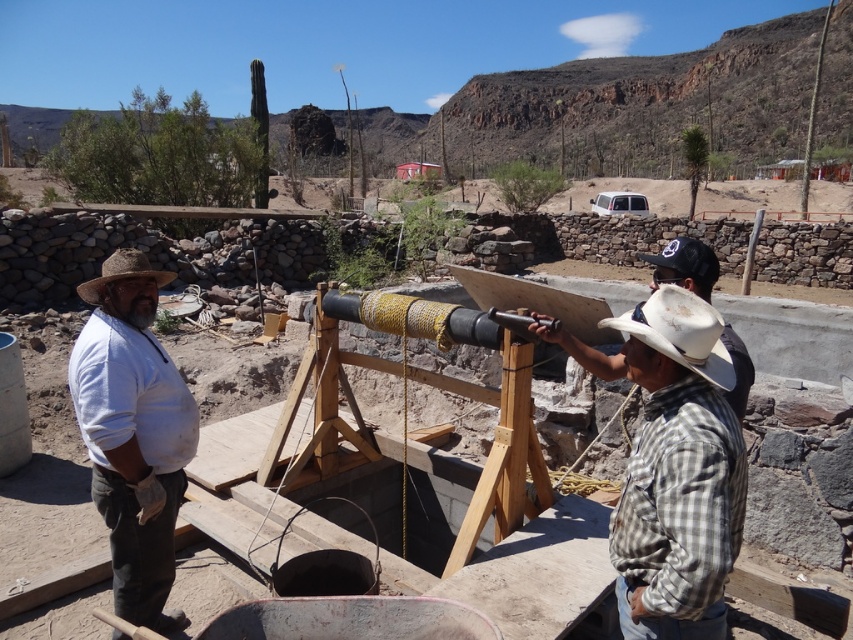
Is white checkered shirt at center above wooden telescope at center?

No.

Is white checkered shirt at center positioned behind wooden telescope at center?

That is False.

At what (x,y) coordinates should I click in order to perform the action: click on white checkered shirt at center. Please return your answer as a coordinate pair (x, y). Image resolution: width=853 pixels, height=640 pixels. Looking at the image, I should click on (677, 474).

Is white cotton shirt at left to the right of brown straw cowboy hat at left from the viewer's perspective?

Yes, white cotton shirt at left is to the right of brown straw cowboy hat at left.

Does point (112, 282) come closer to viewer compared to point (134, 262)?

Yes, point (112, 282) is in front of point (134, 262).

Locate an element on the screen. This screenshot has width=853, height=640. white cotton shirt at left is located at coordinates (132, 433).

Which is below, white checkered shirt at center or brown straw cowboy hat at left?

Positioned lower is white checkered shirt at center.

Which of these two, white checkered shirt at center or brown straw cowboy hat at left, stands shorter?

Standing shorter between the two is white checkered shirt at center.

Which is behind, point (637, 508) or point (128, 260)?

The point (128, 260) is behind.

What are the coordinates of `white checkered shirt at center` in the screenshot? It's located at (677, 474).